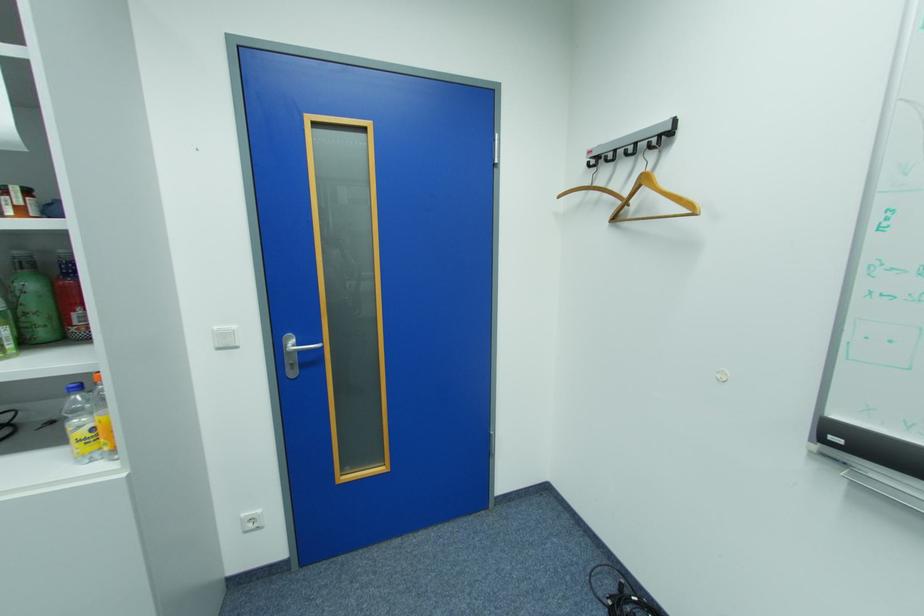
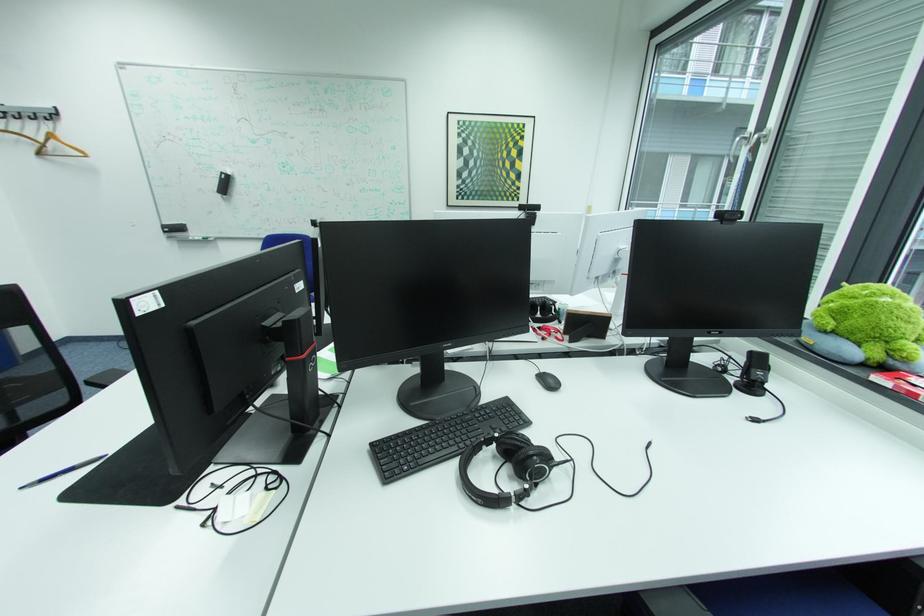
Locate, in the second image, the point that corresponds to the point at 624,220 in the first image.

(49, 153)